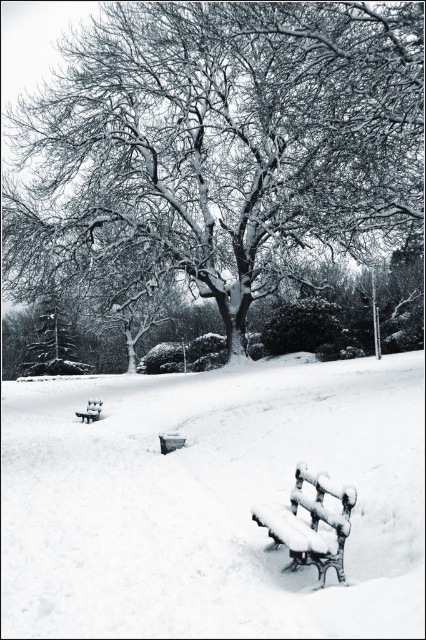
Question: Can you confirm if snow-covered tree at center is positioned below white frosted bench at lower right?

Choices:
 (A) no
 (B) yes

Answer: (A)

Question: Which point is closer to the camera?

Choices:
 (A) snow-covered wooden bench at lower center
 (B) snow-covered wood bench at lower center

Answer: (B)

Question: Which point is farther from the camera taking this photo?

Choices:
 (A) (x=314, y=550)
 (B) (x=337, y=132)
 (C) (x=158, y=524)

Answer: (B)

Question: Can you confirm if white frosted bench at lower right is thinner than snow-covered wooden bench at lower center?

Choices:
 (A) no
 (B) yes

Answer: (A)

Question: Among these objects, which one is nearest to the camera?

Choices:
 (A) snow-covered tree at center
 (B) white frosted bench at lower right
 (C) snow-covered wood bench at lower center
 (D) snow-covered wooden bench at lower center

Answer: (B)

Question: Can you confirm if white frosted bench at lower right is positioned above snow-covered wood bench at lower center?

Choices:
 (A) yes
 (B) no

Answer: (A)